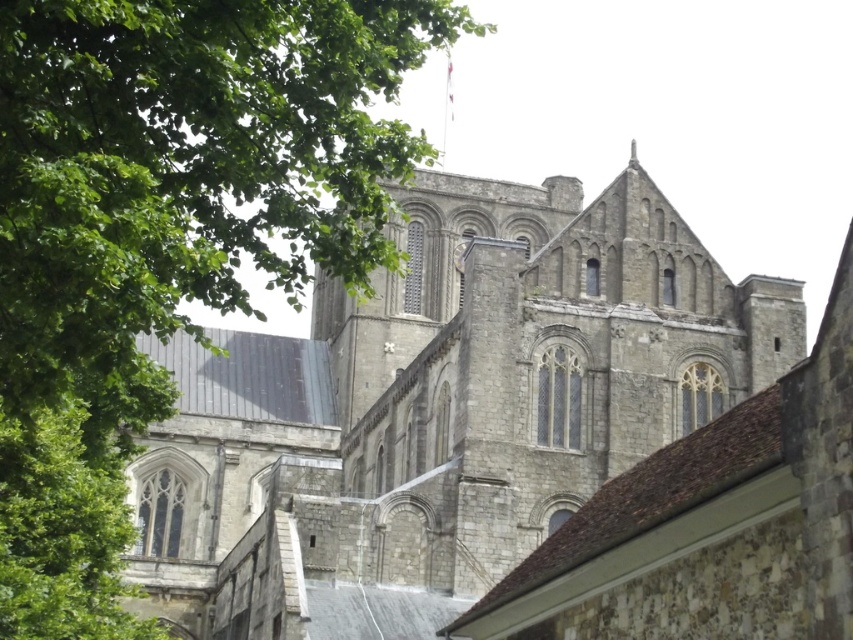
Does stone church at center appear on the right side of green leafy tree at left?

Correct, you'll find stone church at center to the right of green leafy tree at left.

Image resolution: width=853 pixels, height=640 pixels. What do you see at coordinates (440, 410) in the screenshot?
I see `stone church at center` at bounding box center [440, 410].

Identify the location of stone church at center. The width and height of the screenshot is (853, 640). (440, 410).

Locate an element on the screen. stone church at center is located at coordinates (440, 410).

What are the coordinates of `stone church at center` in the screenshot? It's located at (440, 410).

Does green leafy tree at upper left have a greater width compared to green leafy tree at left?

Indeed, green leafy tree at upper left has a greater width compared to green leafy tree at left.

Does green leafy tree at upper left have a greater height compared to green leafy tree at left?

Yes.

Measure the distance between green leafy tree at upper left and camera.

The distance of green leafy tree at upper left from camera is 23.82 meters.

At what (x,y) coordinates should I click in order to perform the action: click on green leafy tree at upper left. Please return your answer as a coordinate pair (x, y). Image resolution: width=853 pixels, height=640 pixels. Looking at the image, I should click on (164, 232).